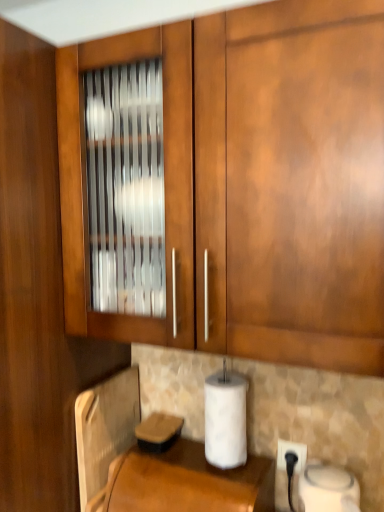
Image resolution: width=384 pixels, height=512 pixels. Describe the element at coordinates (225, 419) in the screenshot. I see `white matte paper towel at lower center` at that location.

Where is `white plastic electric outlet at lower right`? Image resolution: width=384 pixels, height=512 pixels. white plastic electric outlet at lower right is located at coordinates (293, 452).

In the scene shown: Considering the relative sizes of glossy wood cabinet at upper left and white plastic electric outlet at lower right in the image provided, is glossy wood cabinet at upper left shorter than white plastic electric outlet at lower right?

No, glossy wood cabinet at upper left is not shorter than white plastic electric outlet at lower right.

Is the position of glossy wood cabinet at upper left less distant than that of white plastic electric outlet at lower right?

Yes, it is.

Does glossy wood cabinet at upper left appear on the right side of white plastic electric outlet at lower right?

No, glossy wood cabinet at upper left is not to the right of white plastic electric outlet at lower right.

Is the surface of glossy wood cabinet at upper left in direct contact with white plastic electric outlet at lower right?

glossy wood cabinet at upper left and white plastic electric outlet at lower right are not in contact.

From a real-world perspective, does white matte paper towel at lower center sit lower than white plastic electric outlet at lower right?

No.

From the image's perspective, between white matte paper towel at lower center and white plastic electric outlet at lower right, who is located below?

From the image's view, white plastic electric outlet at lower right is below.

Is white matte paper towel at lower center located outside white plastic electric outlet at lower right?

Absolutely, white matte paper towel at lower center is external to white plastic electric outlet at lower right.

Where is `cabinetry that appears in front of the metallic silver toaster at lower left`? This screenshot has width=384, height=512. cabinetry that appears in front of the metallic silver toaster at lower left is located at coordinates (246, 183).

Is point (301, 101) more distant than point (135, 419)?

That is False.

Which is in front, glossy wood cabinet at upper left or metallic silver toaster at lower left?

glossy wood cabinet at upper left.

From the picture: Between white plastic electric outlet at lower right and white matte paper towel at lower center, which one has smaller width?

white plastic electric outlet at lower right.

Relative to white matte paper towel at lower center, is white plastic electric outlet at lower right in front or behind?

Clearly, white plastic electric outlet at lower right is behind white matte paper towel at lower center.

From a real-world perspective, is white plastic electric outlet at lower right over white matte paper towel at lower center?

No.

Which of these two, white plastic electric outlet at lower right or white matte paper towel at lower center, is bigger?

white matte paper towel at lower center.

From the image's perspective, between white plastic electric outlet at lower right and glossy wood cabinet at upper left, who is located below?

white plastic electric outlet at lower right, from the image's perspective.

How much distance is there between white plastic electric outlet at lower right and glossy wood cabinet at upper left?

white plastic electric outlet at lower right is 29.25 inches away from glossy wood cabinet at upper left.

Is white plastic electric outlet at lower right to the left of glossy wood cabinet at upper left from the viewer's perspective?

No, white plastic electric outlet at lower right is not to the left of glossy wood cabinet at upper left.

Between white plastic electric outlet at lower right and glossy wood cabinet at upper left, which one has smaller width?

white plastic electric outlet at lower right.

At what (x,y) coordinates should I click in order to perform the action: click on paper towel that appears in front of the metallic silver toaster at lower left. Please return your answer as a coordinate pair (x, y). Looking at the image, I should click on (225, 419).

Is metallic silver toaster at lower left oriented away from white matte paper towel at lower center?

No, metallic silver toaster at lower left's orientation is not away from white matte paper towel at lower center.

Considering the sizes of metallic silver toaster at lower left and white matte paper towel at lower center in the image, is metallic silver toaster at lower left wider or thinner than white matte paper towel at lower center?

In the image, metallic silver toaster at lower left appears to be more narrow than white matte paper towel at lower center.

Based on the photo, between white plastic electric outlet at lower right and metallic silver toaster at lower left, which one is positioned in front?

metallic silver toaster at lower left.

Does white plastic electric outlet at lower right touch metallic silver toaster at lower left?

No, white plastic electric outlet at lower right is not making contact with metallic silver toaster at lower left.

Which point is more distant from viewer, (x=298, y=470) or (x=102, y=402)?

The point (x=102, y=402) is behind.

Does white plastic electric outlet at lower right have a lesser height compared to metallic silver toaster at lower left?

Yes.

Where is `electric outlet below the glossy wood cabinet at upper left (from the image's perspective)`? This screenshot has height=512, width=384. electric outlet below the glossy wood cabinet at upper left (from the image's perspective) is located at coordinates (293, 452).

Identify the location of electric outlet behind the white matte paper towel at lower center. (293, 452).

Considering their positions, is white plastic electric outlet at lower right positioned closer to brown leather at lower center than metallic silver toaster at lower left?

metallic silver toaster at lower left is closer to brown leather at lower center.

Which object lies nearer to the anchor point glossy wood cabinet at upper left, metallic silver toaster at lower left or brown leather at lower center?

metallic silver toaster at lower left is positioned closer to the anchor glossy wood cabinet at upper left.

Considering their positions, is brown leather at lower center positioned further to metallic silver toaster at lower left than glossy wood cabinet at upper left?

glossy wood cabinet at upper left is further to metallic silver toaster at lower left.

Estimate the real-world distances between objects in this image. Which object is closer to white plastic electric outlet at lower right, glossy wood cabinet at upper left or brown leather at lower center?

brown leather at lower center is positioned closer to the anchor white plastic electric outlet at lower right.

Estimate the real-world distances between objects in this image. Which object is closer to white matte paper towel at lower center, brown leather at lower center or white plastic electric outlet at lower right?

brown leather at lower center is closer to white matte paper towel at lower center.

Which object lies further to the anchor point metallic silver toaster at lower left, white matte paper towel at lower center or glossy wood cabinet at upper left?

glossy wood cabinet at upper left lies further to metallic silver toaster at lower left than the other object.

Estimate the real-world distances between objects in this image. Which object is further from white matte paper towel at lower center, white plastic electric outlet at lower right or metallic silver toaster at lower left?

metallic silver toaster at lower left is further to white matte paper towel at lower center.

When comparing their distances from metallic silver toaster at lower left, does white plastic electric outlet at lower right or white matte paper towel at lower center seem closer?

white matte paper towel at lower center is positioned closer to the anchor metallic silver toaster at lower left.

What are the coordinates of `electric outlet between glossy wood cabinet at upper left and brown leather at lower center vertically` in the screenshot? It's located at (293, 452).

Image resolution: width=384 pixels, height=512 pixels. In order to click on counter top between metallic silver toaster at lower left and white matte paper towel at lower center in the horizontal direction in this screenshot , I will do `click(188, 482)`.

Find the location of a particular element. This screenshot has width=384, height=512. paper towel between metallic silver toaster at lower left and white plastic electric outlet at lower right from left to right is located at coordinates (225, 419).

You are a GUI agent. You are given a task and a screenshot of the screen. Output one action in this format:
    pyautogui.click(x=<x>, y=<y>)
    Task: Click on the appliance between glossy wood cabinet at upper left and brown leather at lower center in the up-down direction
    This screenshot has width=384, height=512.
    Given the screenshot: What is the action you would take?
    pyautogui.click(x=105, y=433)